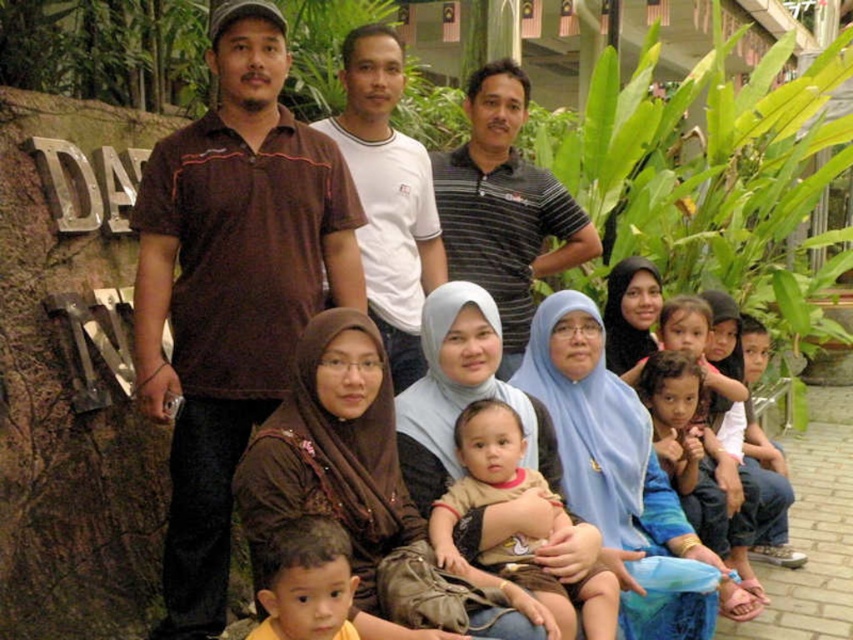
You are standing in the garden scene where the group is posing. You need to locate the brown cotton shirt at left and the brown hair at center. Which one is positioned higher from the ground?

The brown cotton shirt at left is located above the brown hair at center, so it is positioned higher from the ground.

You are a photographer trying to focus on the striped polo shirt at upper center and the brown hair at center. Which object should you adjust your camera focus on first if you want to ensure both are in focus, considering their sizes?

The striped polo shirt at upper center is larger in size than the brown hair at center, so you should focus on the striped polo shirt at upper center first to ensure both are in focus.